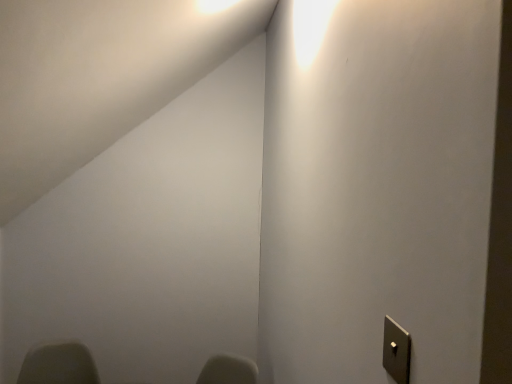
What do you see at coordinates (396, 351) in the screenshot? The image size is (512, 384). I see `satin silver switch at lower right` at bounding box center [396, 351].

The image size is (512, 384). What are the coordinates of `satin silver switch at lower right` in the screenshot? It's located at (396, 351).

You are a GUI agent. You are given a task and a screenshot of the screen. Output one action in this format:
    pyautogui.click(x=<x>, y=<y>)
    Task: Click on the satin silver switch at lower right
    Image resolution: width=512 pixels, height=384 pixels.
    Given the screenshot: What is the action you would take?
    pyautogui.click(x=396, y=351)